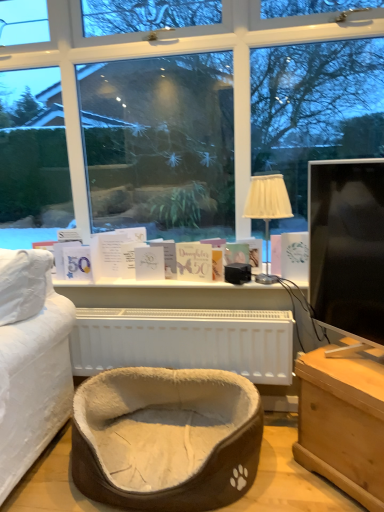
At what (x,y) coordinates should I click in order to perform the action: click on vacant space in black glossy monitor at right (from a real-world perspective). Please return your answer as a coordinate pair (x, y). The width and height of the screenshot is (384, 512). Looking at the image, I should click on (354, 362).